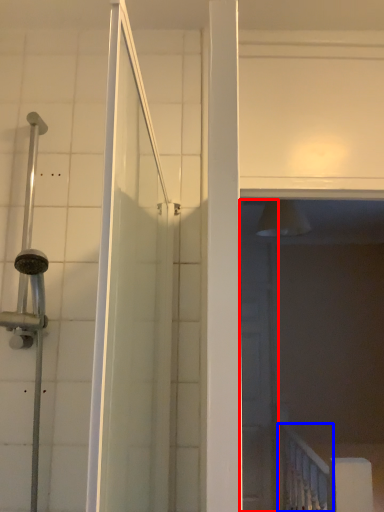
Question: Which of the following is the farthest to the observer, screen door (highlighted by a red box) or rail (highlighted by a blue box)?

Choices:
 (A) screen door
 (B) rail

Answer: (A)